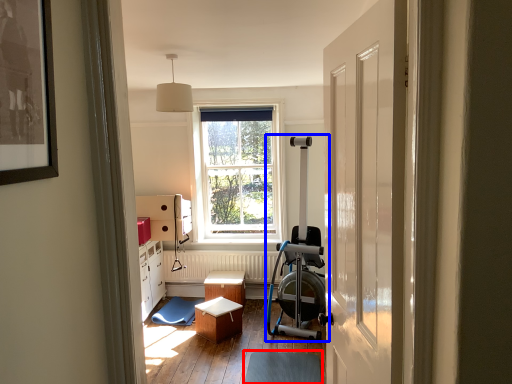
Question: Which object appears farthest to the camera in this image, footrest (highlighted by a red box) or baby carriage (highlighted by a blue box)?

Choices:
 (A) footrest
 (B) baby carriage

Answer: (B)